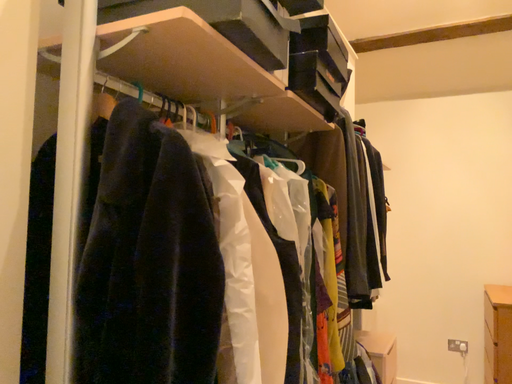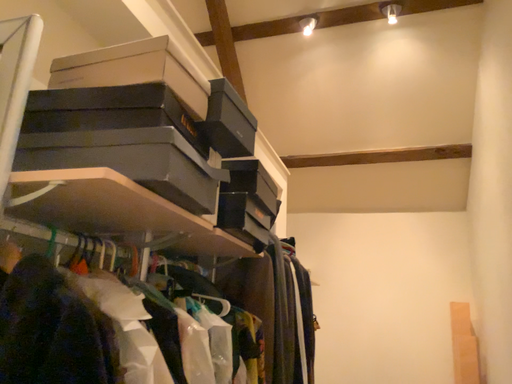
Question: How did the camera likely rotate when shooting the video?

Choices:
 (A) rotated left
 (B) rotated right

Answer: (B)